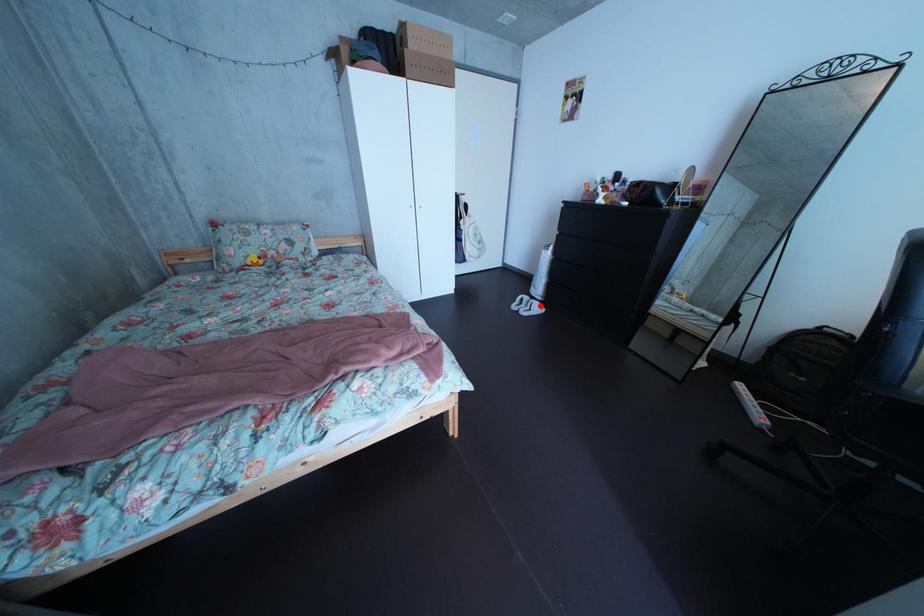
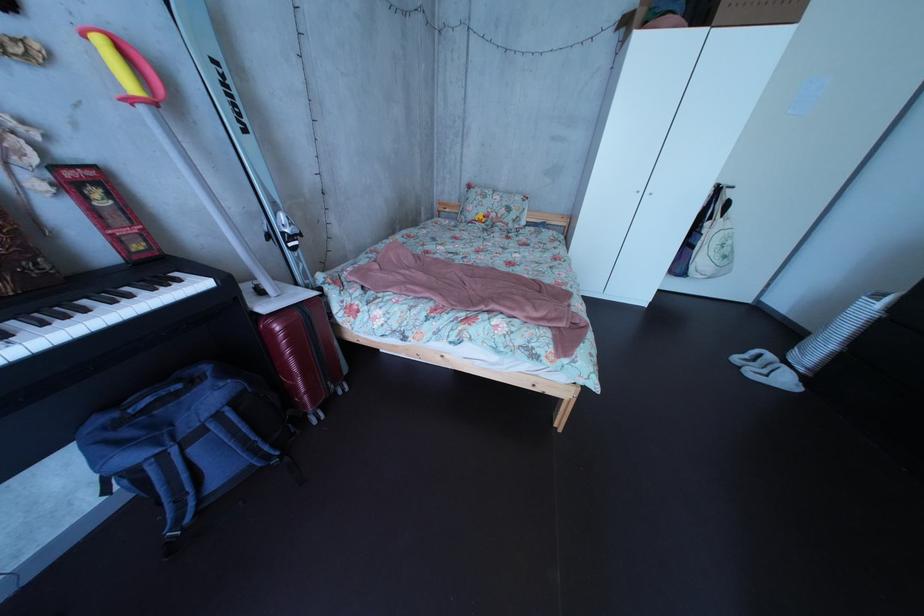
Question: I am providing you with two images of the same scene from different viewpoints. Given a red point in image1, look at the same physical point in image2. Is it:

Choices:
 (A) Closer to the viewpoint
 (B) Farther from the viewpoint

Answer: (B)